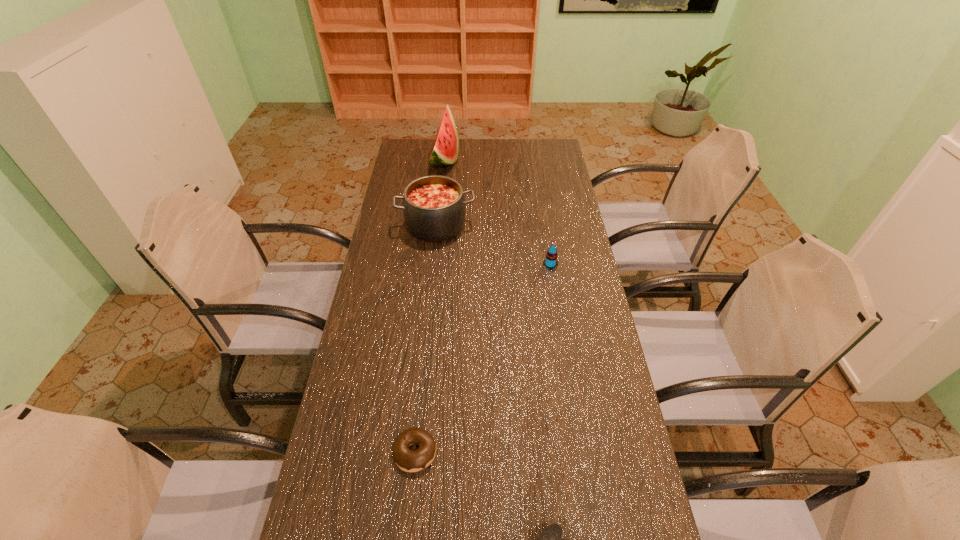
Find the location of a particular element. The width and height of the screenshot is (960, 540). vacant space at the far left corner of the desktop is located at coordinates (406, 156).

Locate an element on the screen. unoccupied area between the third farthest object and the casserole is located at coordinates (493, 245).

The width and height of the screenshot is (960, 540). What are the coordinates of `free area in between the second tallest object and the fourth farthest object` in the screenshot? It's located at (425, 339).

Where is `free spot between the doughnut and the second farthest object`? The height and width of the screenshot is (540, 960). free spot between the doughnut and the second farthest object is located at coordinates (425, 339).

Where is `free space between the watermelon and the third nearest object`? The width and height of the screenshot is (960, 540). free space between the watermelon and the third nearest object is located at coordinates (497, 212).

Where is `vacant area that lies between the soda and the second farthest object`? This screenshot has height=540, width=960. vacant area that lies between the soda and the second farthest object is located at coordinates (493, 245).

Identify the location of free space between the third shortest object and the fourth farthest object. This screenshot has height=540, width=960. (483, 358).

Identify which object is located as the nearest to the soda. Please provide its 2D coordinates. Your answer should be formatted as a tuple, i.e. [(x, y)], where the tuple contains the x and y coordinates of a point satisfying the conditions above.

[(434, 206)]

Locate which object is the closest to the watermelon. Please provide its 2D coordinates. Your answer should be formatted as a tuple, i.e. [(x, y)], where the tuple contains the x and y coordinates of a point satisfying the conditions above.

[(434, 206)]

Where is `vacant space that satisfies the following two spatial constraints: 1. on the outer rind of the third shortest object; 2. on the right side of the tallest object`? The width and height of the screenshot is (960, 540). vacant space that satisfies the following two spatial constraints: 1. on the outer rind of the third shortest object; 2. on the right side of the tallest object is located at coordinates (433, 265).